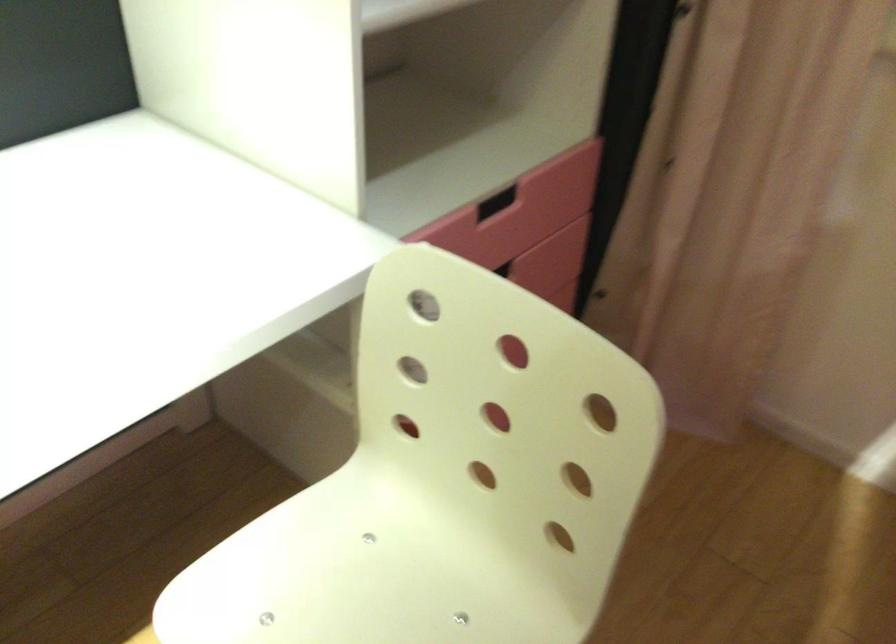
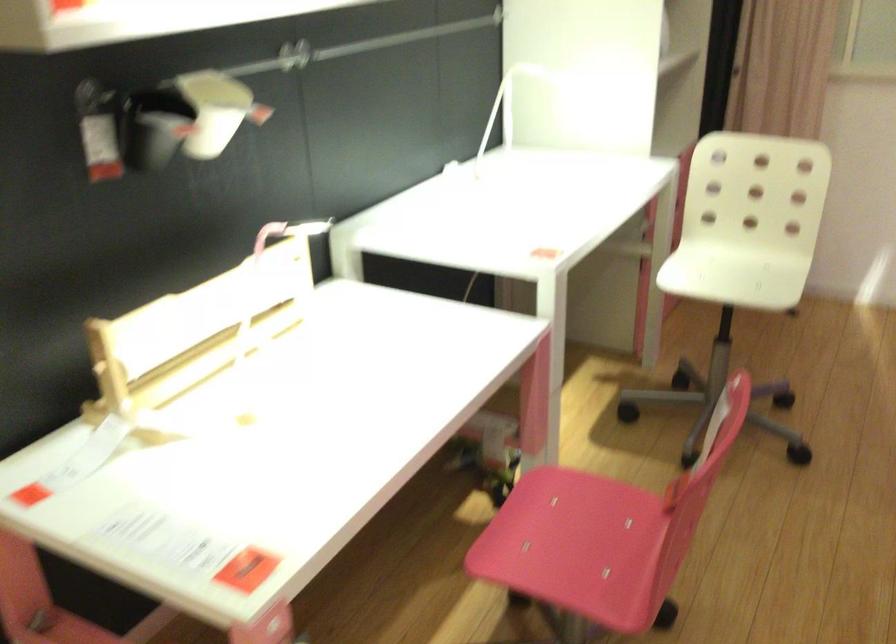
Consider the image. What movement of the cameraman would produce the second image?

The movement direction of the cameraman is left, backward.